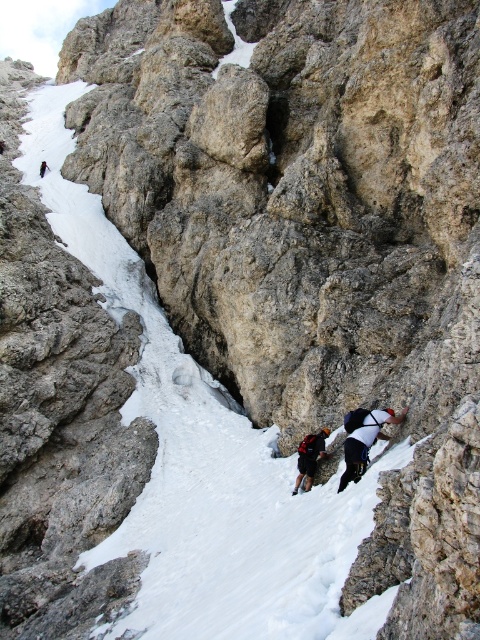
Question: Is white fabric climbing harness at right to the left of dark gray fabric backpack at center from the viewer's perspective?

Choices:
 (A) yes
 (B) no

Answer: (B)

Question: Observing the image, what is the correct spatial positioning of white fabric climbing harness at right in reference to dark gray fabric backpack at center?

Choices:
 (A) right
 (B) left

Answer: (A)

Question: Can you confirm if white fabric climbing harness at right is bigger than dark gray fabric backpack at center?

Choices:
 (A) yes
 (B) no

Answer: (A)

Question: Which of the following is the farthest from the observer?

Choices:
 (A) dark gray fabric backpack at center
 (B) white fabric climbing harness at right

Answer: (A)

Question: Which point appears closest to the camera in this image?

Choices:
 (A) (317, 435)
 (B) (363, 464)

Answer: (B)